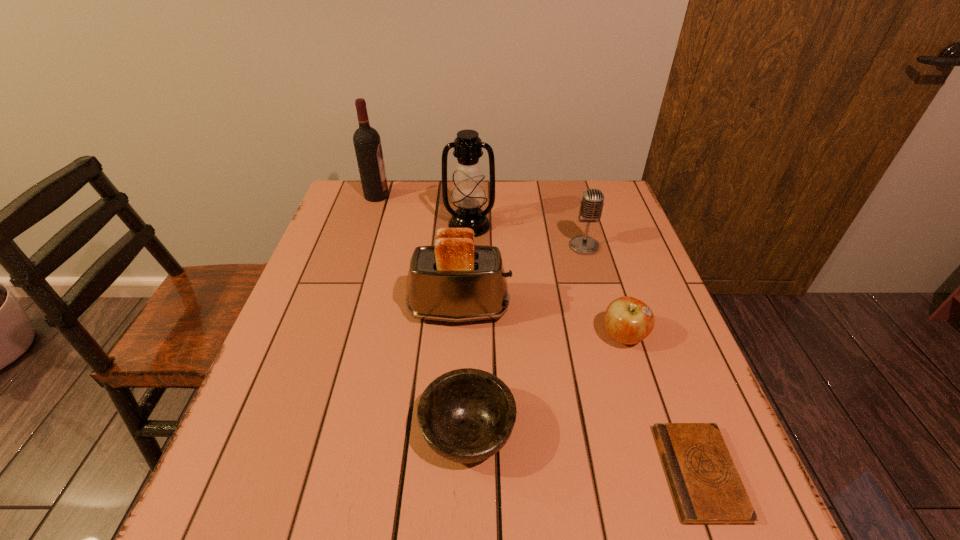
At what (x,y) coordinates should I click in order to perform the action: click on vacant position in the image that satisfies the following two spatial constraints: 1. on the back side of the microphone; 2. on the label of the leftmost object. Please return your answer as a coordinate pair (x, y). This screenshot has width=960, height=540. Looking at the image, I should click on (569, 196).

Find the location of a particular element. The width and height of the screenshot is (960, 540). free spot that satisfies the following two spatial constraints: 1. on the front side of the oil lamp; 2. on the left side of the apple is located at coordinates (466, 336).

Locate an element on the screen. vacant region that satisfies the following two spatial constraints: 1. on the label of the oil lamp; 2. on the right side of the wine bottle is located at coordinates (367, 225).